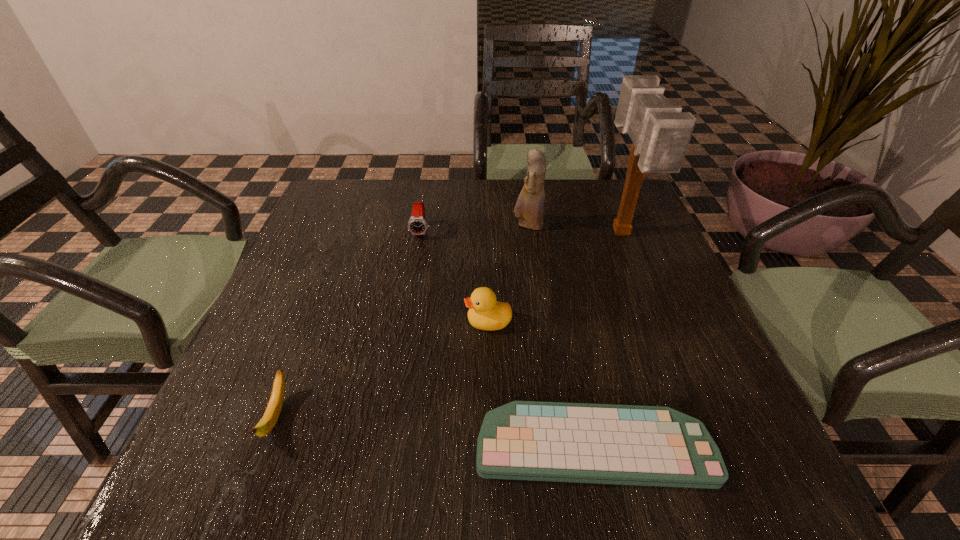
Locate an element on the screen. Image resolution: width=960 pixels, height=540 pixels. free spot between the leftmost object and the third nearest object is located at coordinates (382, 369).

The height and width of the screenshot is (540, 960). In order to click on blank region between the tallest object and the fifth object from right to left in this screenshot , I will do `click(521, 233)`.

This screenshot has width=960, height=540. What are the coordinates of `vacant region between the shortest object and the fifth object from right to left` in the screenshot? It's located at (507, 339).

Locate an element on the screen. The image size is (960, 540). vacant area between the computer keyboard and the mallet is located at coordinates (607, 340).

Identify the location of object that can be found as the second closest to the computer keyboard. click(x=266, y=424).

Locate which object ranks second in proximity to the watch. Please provide its 2D coordinates. Your answer should be formatted as a tuple, i.e. [(x, y)], where the tuple contains the x and y coordinates of a point satisfying the conditions above.

[(484, 313)]

Find the location of a particular element. This screenshot has width=960, height=540. free space that satisfies the following two spatial constraints: 1. at the beak of the duck; 2. on the right side of the shortest object is located at coordinates (491, 446).

At what (x,y) coordinates should I click in order to perform the action: click on free spot that satisfies the following two spatial constraints: 1. on the back side of the shortest object; 2. at the beak of the third nearest object. Please return your answer as a coordinate pair (x, y). This screenshot has height=540, width=960. Looking at the image, I should click on (568, 322).

Where is `vacant space that satisfies the following two spatial constraints: 1. on the face of the mallet; 2. on the left side of the watch`? vacant space that satisfies the following two spatial constraints: 1. on the face of the mallet; 2. on the left side of the watch is located at coordinates (421, 234).

This screenshot has width=960, height=540. What are the coordinates of `vacant position in the image that satisfies the following two spatial constraints: 1. on the front-facing side of the fifth shortest object; 2. on the right side of the mallet` in the screenshot? It's located at (529, 234).